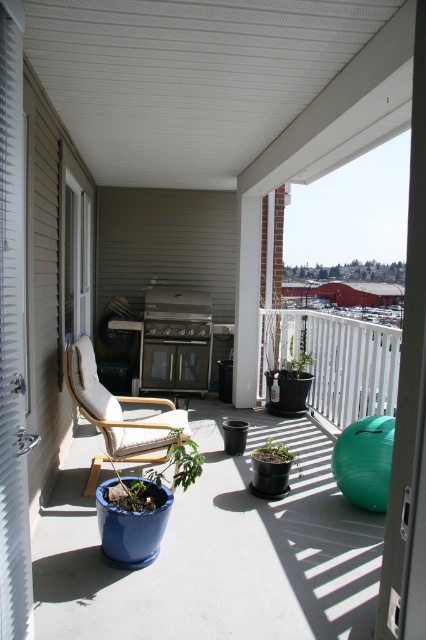
Question: Is matte white chair at left above stainless steel grill at center?

Choices:
 (A) yes
 (B) no

Answer: (B)

Question: Which of these objects is positioned farthest from the white fabric armchair at center?

Choices:
 (A) matte blue pot at center
 (B) matte white chair at left
 (C) green matte plant at center
 (D) stainless steel grill at center

Answer: (D)

Question: From the image, what is the correct spatial relationship of matte white chair at left in relation to stainless steel grill at center?

Choices:
 (A) right
 (B) left

Answer: (A)

Question: Which point is closer to the camera?

Choices:
 (A) white fabric armchair at center
 (B) stainless steel grill at center
 (C) matte white chair at left

Answer: (C)

Question: Is white fabric armchair at center in front of stainless steel grill at center?

Choices:
 (A) yes
 (B) no

Answer: (A)

Question: Which object is farther from the camera taking this photo?

Choices:
 (A) green matte plant at center
 (B) matte white chair at left
 (C) matte blue pot at center
 (D) stainless steel grill at center

Answer: (D)